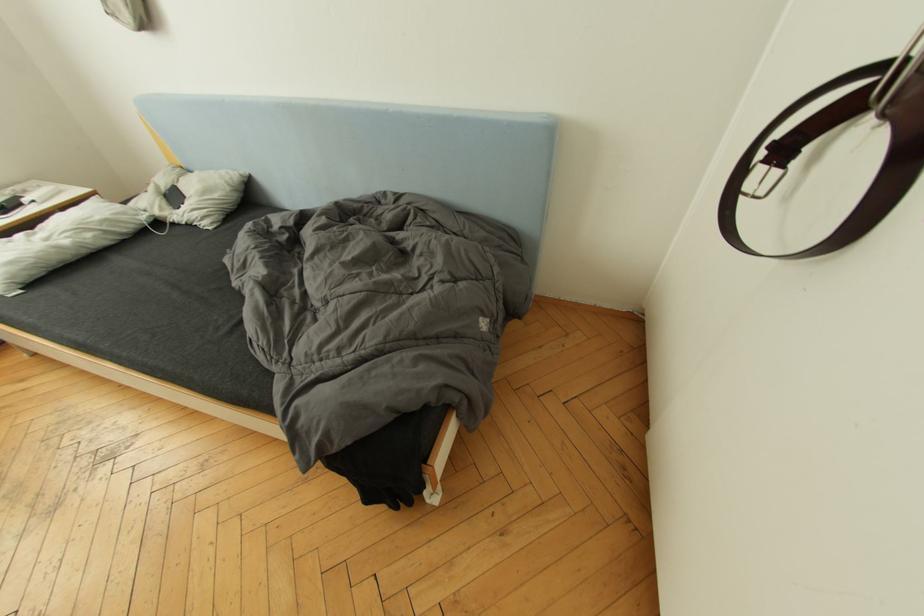
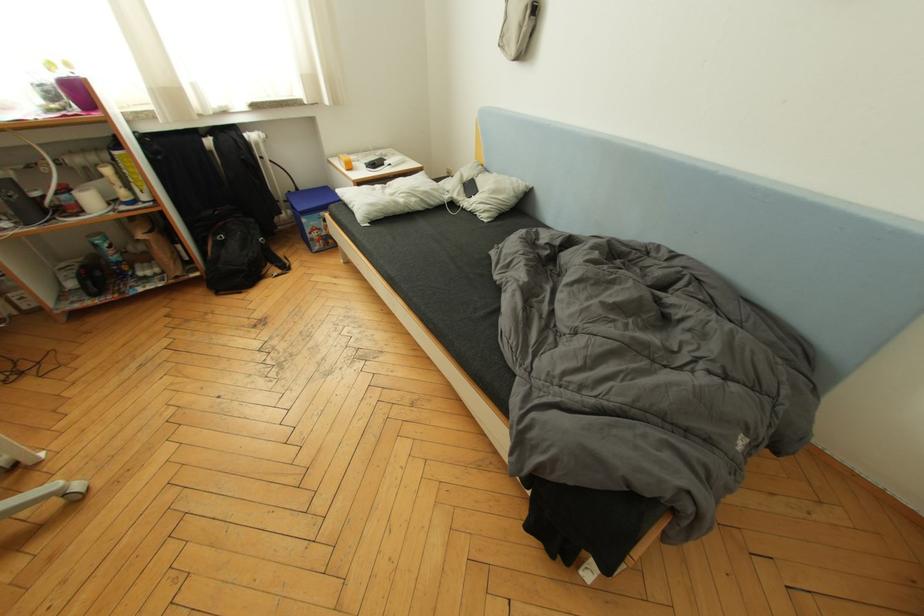
Question: The first image is from the beginning of the video and the second image is from the end. How did the camera likely rotate when shooting the video?

Choices:
 (A) Left
 (B) Right
 (C) Up
 (D) Down

Answer: (A)